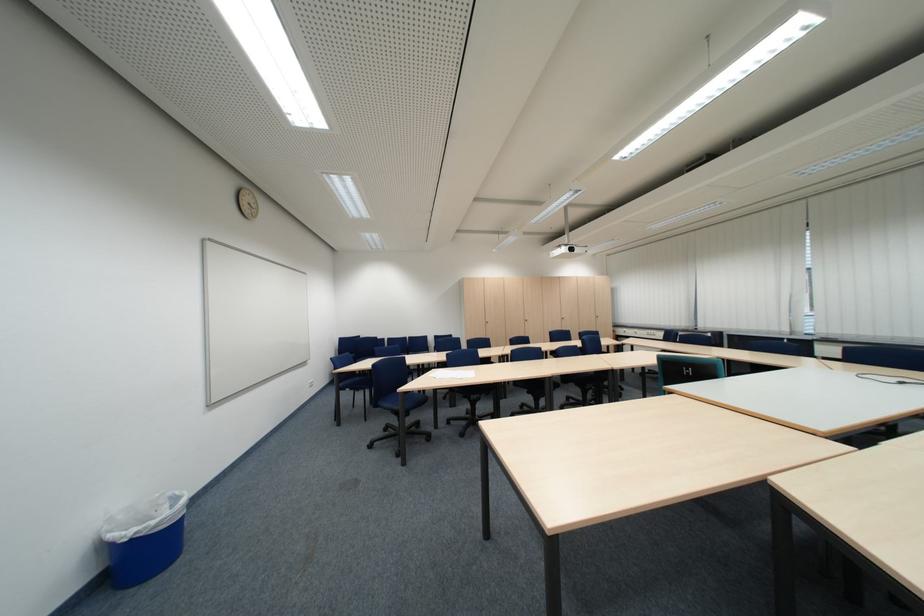
What do you see at coordinates (144, 538) in the screenshot? I see `the blue trash can` at bounding box center [144, 538].